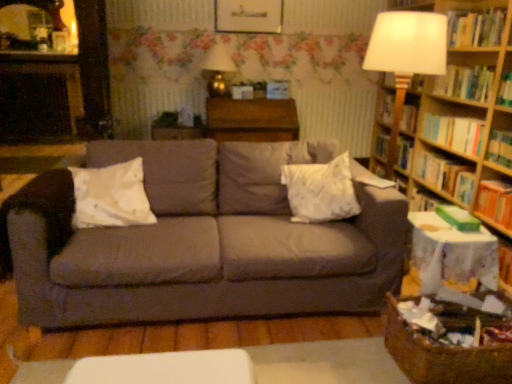
Question: From a real-world perspective, is gray fabric couch at center under white fabric pillow at center, the first pillow in the right-to-left sequence?

Choices:
 (A) no
 (B) yes

Answer: (B)

Question: Is gray fabric couch at center looking in the opposite direction of white fabric pillow at center, the first pillow in the right-to-left sequence?

Choices:
 (A) no
 (B) yes

Answer: (B)

Question: Is gray fabric couch at center directly adjacent to white fabric pillow at center, the first pillow in the right-to-left sequence?

Choices:
 (A) yes
 (B) no

Answer: (B)

Question: Are gray fabric couch at center and white fabric pillow at center, the 2th pillow viewed from the left, far apart?

Choices:
 (A) no
 (B) yes

Answer: (A)

Question: Is gray fabric couch at center aimed at white fabric pillow at center, the first pillow in the right-to-left sequence?

Choices:
 (A) no
 (B) yes

Answer: (B)

Question: Considering the positions of point [402, 107] and point [441, 157], is point [402, 107] closer or farther from the camera than point [441, 157]?

Choices:
 (A) closer
 (B) farther

Answer: (B)

Question: From the image's perspective, is hardcover book at right, arranged as the third book when viewed from the top, positioned above or below hardcover book at right, the fifth book viewed from the top?

Choices:
 (A) below
 (B) above

Answer: (B)

Question: Is hardcover book at right, positioned as the fourth book in bottom-to-top order, bigger or smaller than hardcover book at right, the fifth book viewed from the top?

Choices:
 (A) small
 (B) big

Answer: (B)

Question: In terms of width, does hardcover book at right, arranged as the third book when viewed from the top, look wider or thinner when compared to hardcover book at right, the 2th book positioned from the bottom?

Choices:
 (A) wide
 (B) thin

Answer: (A)

Question: Is point (122, 183) positioned closer to the camera than point (482, 84)?

Choices:
 (A) closer
 (B) farther

Answer: (A)

Question: From a real-world perspective, is white soft pillow at left, placed as the second pillow when sorted from right to left, above or below hardcover book at upper right, which is the fifth book in bottom-to-top order?

Choices:
 (A) below
 (B) above

Answer: (A)

Question: In terms of width, does white soft pillow at left, placed as the second pillow when sorted from right to left, look wider or thinner when compared to hardcover book at upper right, the second book viewed from the top?

Choices:
 (A) thin
 (B) wide

Answer: (B)

Question: In terms of size, does white soft pillow at left, placed as the 1th pillow when sorted from left to right, appear bigger or smaller than hardcover book at upper right, which is the fifth book in bottom-to-top order?

Choices:
 (A) small
 (B) big

Answer: (B)

Question: In the image, is wooden table at center on the left side or the right side of orange hardcover book at right, marked as the sixth book in a top-to-bottom arrangement?

Choices:
 (A) left
 (B) right

Answer: (A)

Question: Considering the positions of point (251, 125) and point (499, 208), is point (251, 125) closer or farther from the camera than point (499, 208)?

Choices:
 (A) closer
 (B) farther

Answer: (B)